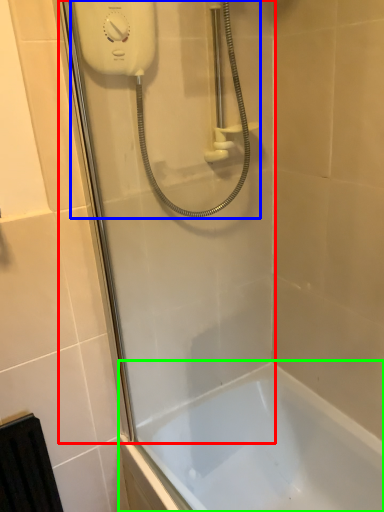
Question: Which is farther away from shower door (highlighted by a red box)? shower (highlighted by a blue box) or bathtub (highlighted by a green box)?

Choices:
 (A) shower
 (B) bathtub

Answer: (B)